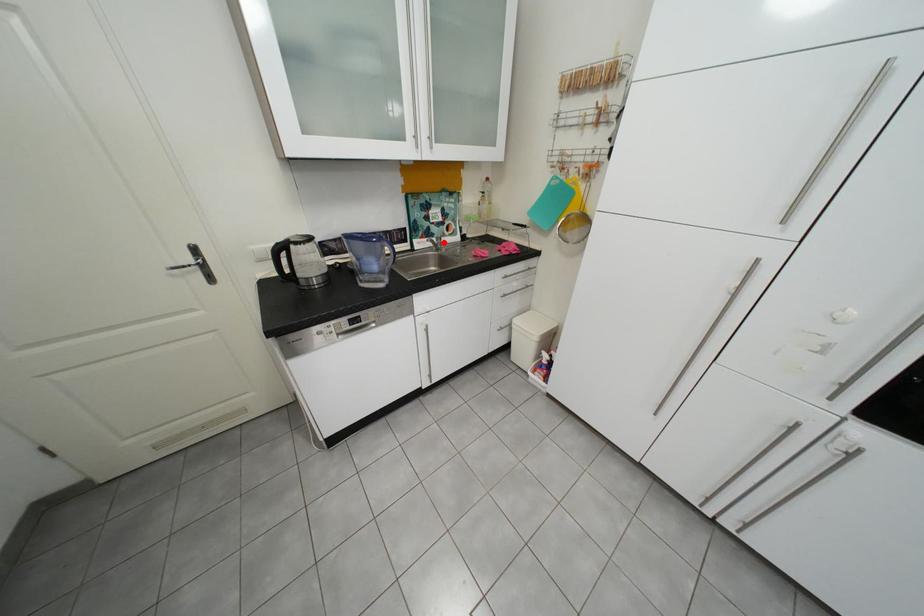
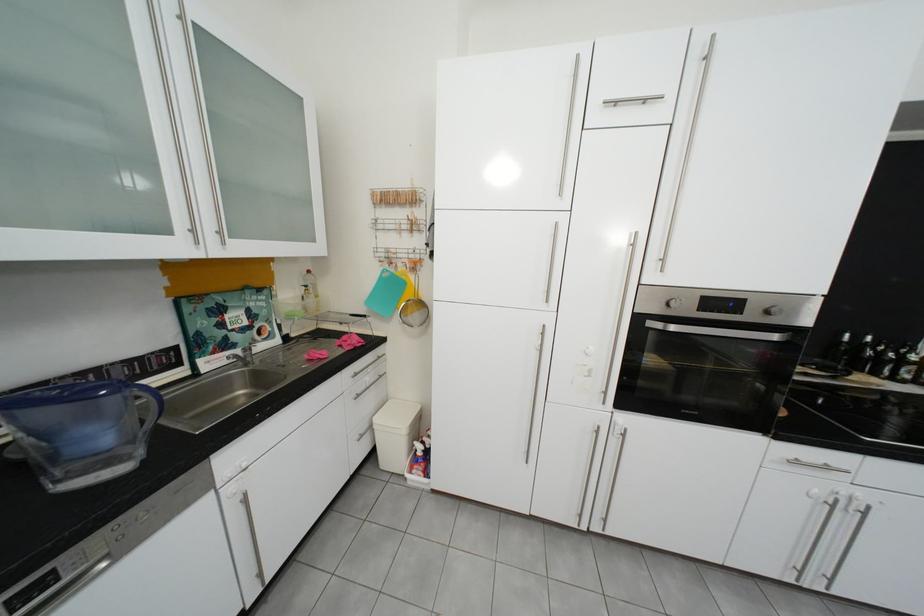
Find the pixel in the second image that matches the highlighted location in the first image.

(248, 358)